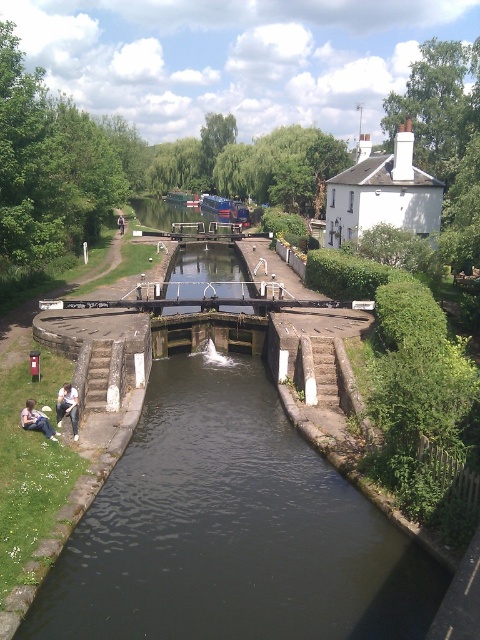
Is dark stone water at center to the left of light brown wooden bench at lower left from the viewer's perspective?

No, dark stone water at center is not to the left of light brown wooden bench at lower left.

Identify the location of dark stone water at center. The image size is (480, 640). (230, 531).

Can you confirm if light brown wooden bench at lower left is taller than light blue jeans at lower left?

Correct, light brown wooden bench at lower left is much taller as light blue jeans at lower left.

Does point (66, 390) come farther from viewer compared to point (37, 420)?

Yes, it is behind point (37, 420).

Does point (72, 390) come behind point (24, 426)?

That is True.

The width and height of the screenshot is (480, 640). What are the coordinates of `light brown wooden bench at lower left` in the screenshot? It's located at (68, 406).

Can you confirm if dark stone water at center is positioned to the left of light blue jeans at lower left?

Incorrect, dark stone water at center is not on the left side of light blue jeans at lower left.

Is dark stone water at center below light blue jeans at lower left?

Yes, dark stone water at center is below light blue jeans at lower left.

Identify the location of dark stone water at center. (230, 531).